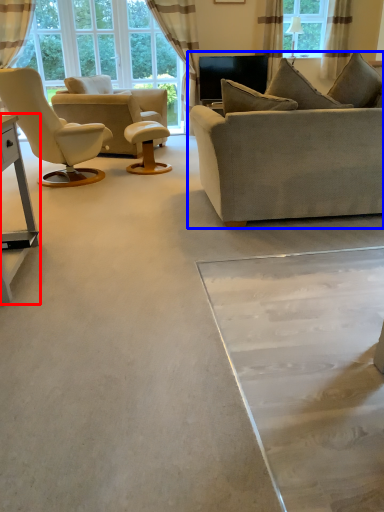
Question: Which object is closer to the camera taking this photo, table (highlighted by a red box) or studio couch (highlighted by a blue box)?

Choices:
 (A) table
 (B) studio couch

Answer: (A)